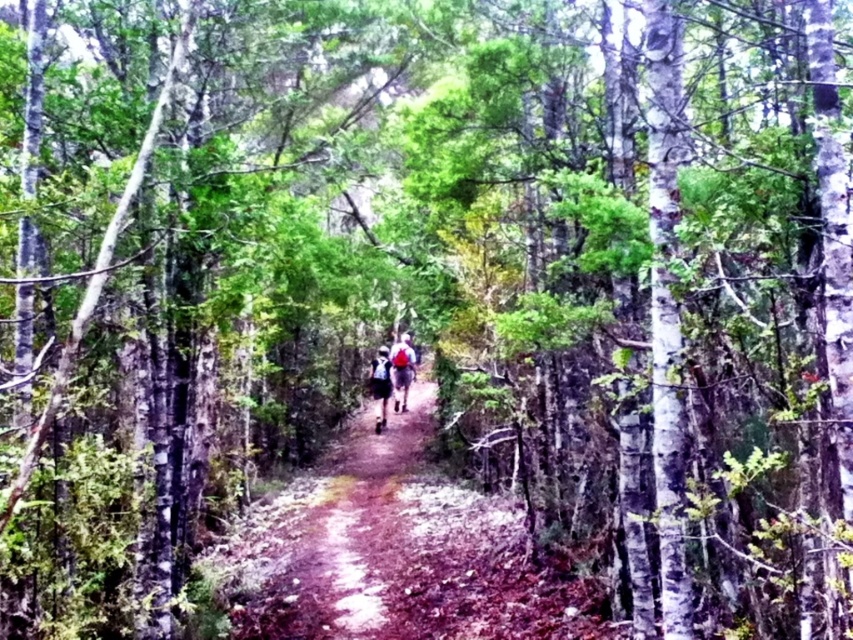
Question: Does brown dirt path at center come in front of red backpack at center?

Choices:
 (A) yes
 (B) no

Answer: (A)

Question: Which object appears closest to the camera in this image?

Choices:
 (A) brown dirt path at center
 (B) dark blue backpack at center
 (C) red backpack at center

Answer: (A)

Question: Among these points, which one is nearest to the camera?

Choices:
 (A) (263, 596)
 (B) (379, 404)

Answer: (A)

Question: Can you confirm if brown dirt path at center is positioned to the left of dark blue backpack at center?

Choices:
 (A) no
 (B) yes

Answer: (B)

Question: Based on their relative distances, which object is nearer to the brown dirt path at center?

Choices:
 (A) dark blue backpack at center
 (B) red backpack at center

Answer: (A)

Question: Is brown dirt path at center in front of red backpack at center?

Choices:
 (A) no
 (B) yes

Answer: (B)